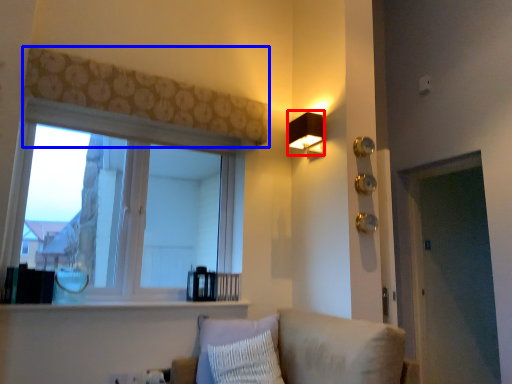
Question: Among these objects, which one is nearest to the camera, lamp (highlighted by a red box) or curtain (highlighted by a blue box)?

Choices:
 (A) lamp
 (B) curtain

Answer: (B)